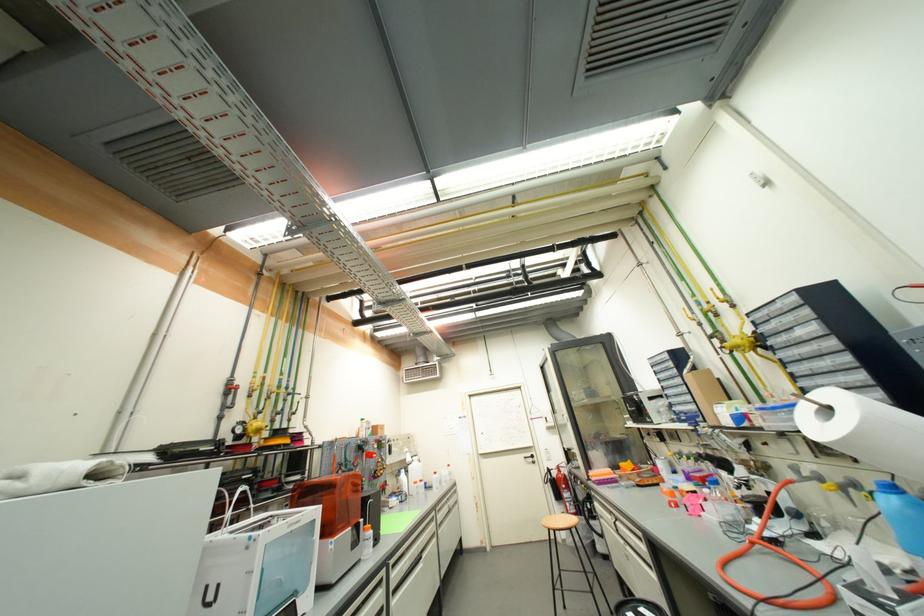
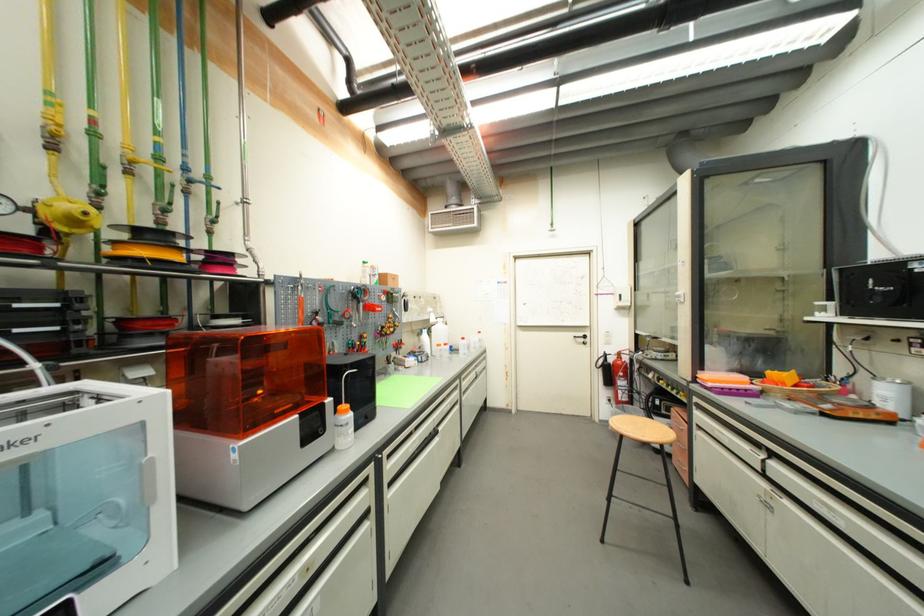
Find the pixel in the second image that matches (263,432) in the first image.

(82, 224)